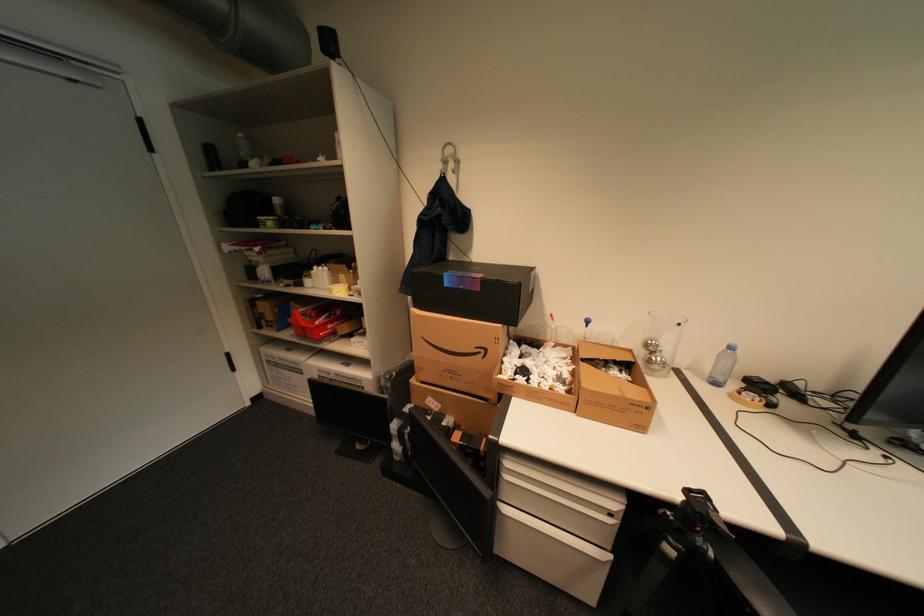
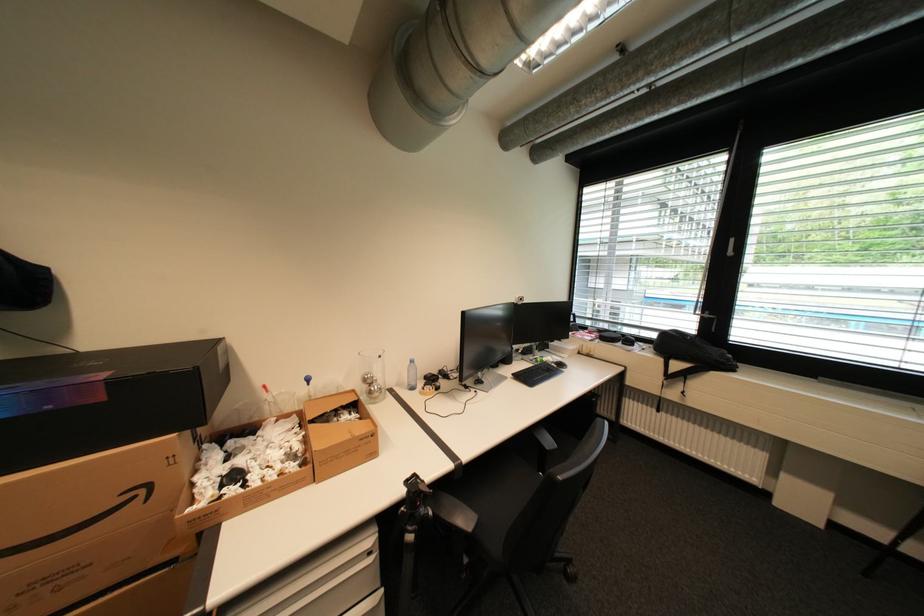
The point at (660, 344) is marked in the first image. Where is the corresponding point in the second image?

(377, 378)